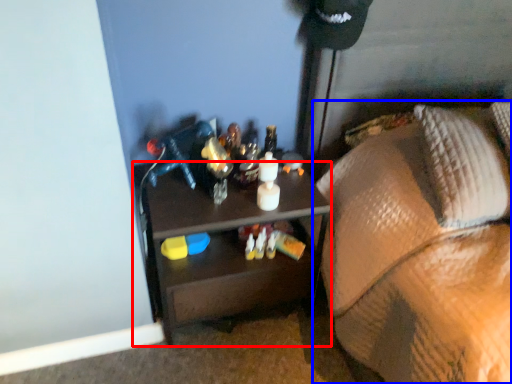
Question: Which of the following is the farthest to the observer, desk (highlighted by a red box) or furniture (highlighted by a blue box)?

Choices:
 (A) desk
 (B) furniture

Answer: (A)